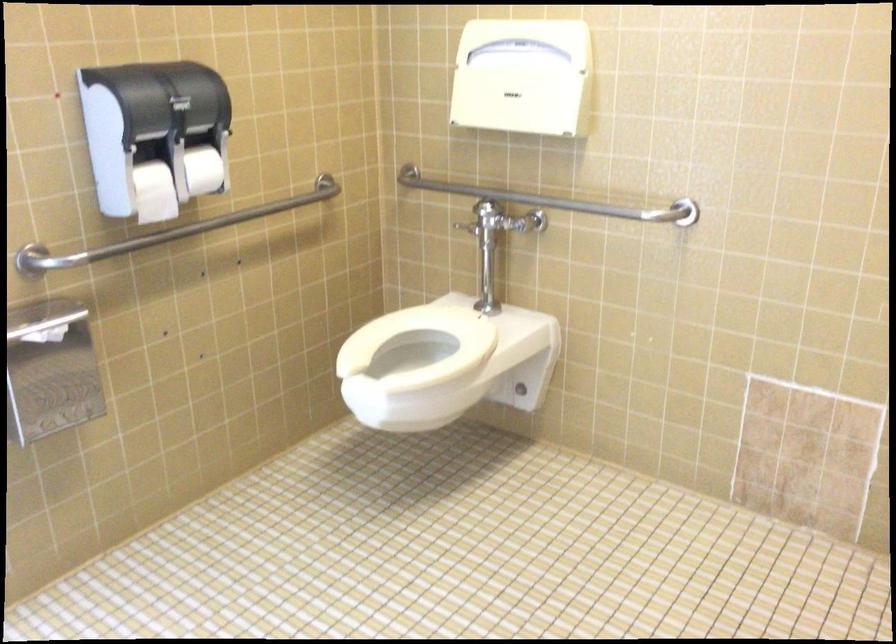
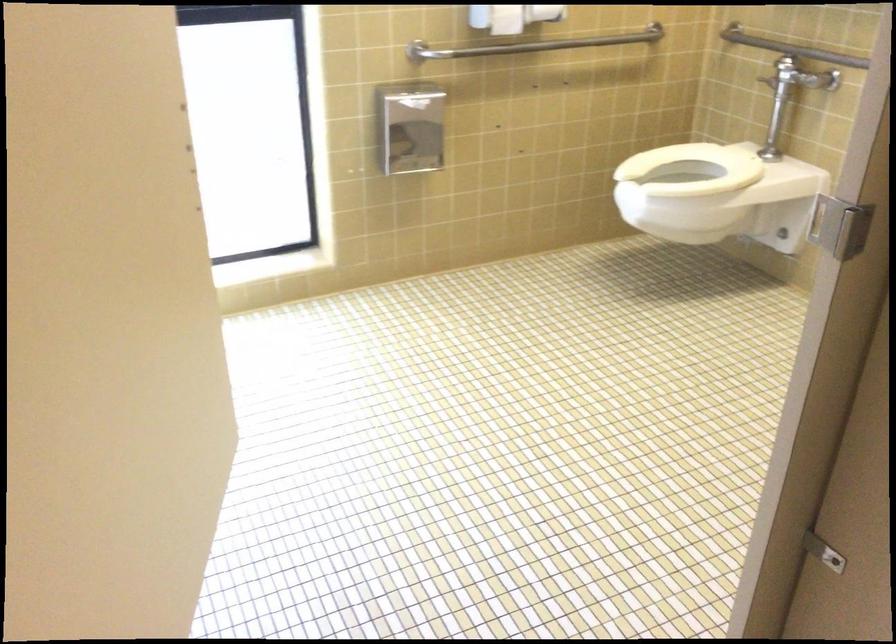
In the second image, find the point that corresponds to point 411,337 in the first image.

(692, 169)